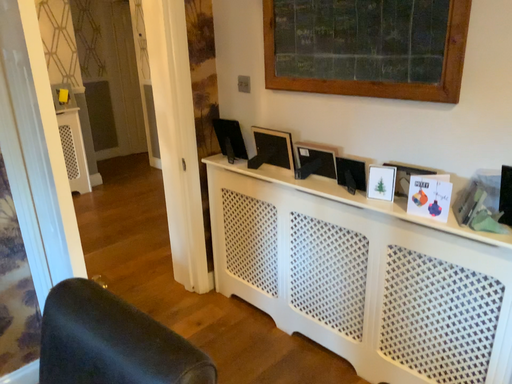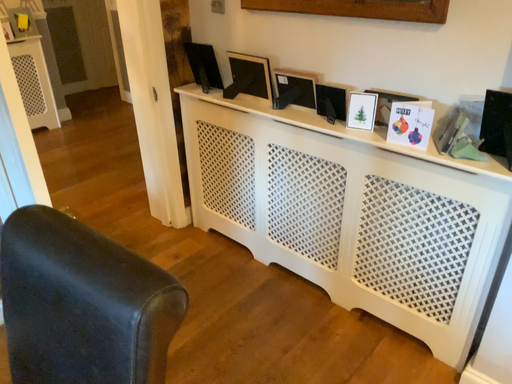
Question: Which way did the camera rotate in the video?

Choices:
 (A) rotated upward
 (B) rotated downward

Answer: (B)